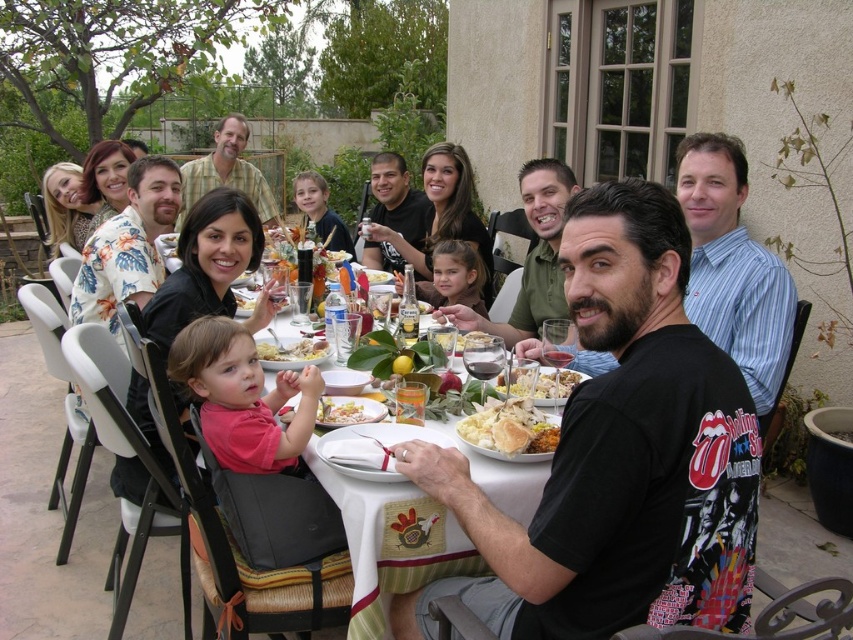
You are a photographer standing at the edge of the patio. You want to take a photo of the white cloth table at center. Where should you position yourself to capture it in the frame?

The white cloth table at center is located at point (390, 540), so you should position yourself at that coordinate to capture it in the frame.

You are a waiter holding a tray of drinks and need to reach the white glossy plate at center from the blue striped shirt at upper right. Can you safely walk the distance without spilling the drinks?

The distance between the blue striped shirt at upper right and the white glossy plate at center is 36.35 inches. Since this distance is manageable for a waiter carrying drinks, you can safely walk the distance without spilling the drinks.